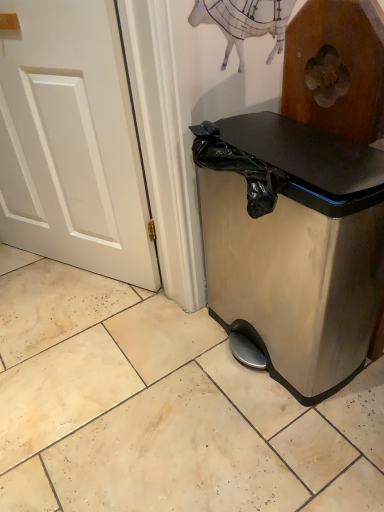
Question: Does satin silver trash can at lower right have a greater width compared to white painted wood door at left?

Choices:
 (A) yes
 (B) no

Answer: (A)

Question: Can you confirm if satin silver trash can at lower right is shorter than white painted wood door at left?

Choices:
 (A) yes
 (B) no

Answer: (A)

Question: From the image's perspective, does satin silver trash can at lower right appear higher than white painted wood door at left?

Choices:
 (A) yes
 (B) no

Answer: (B)

Question: Is white painted wood door at left completely or partially inside satin silver trash can at lower right?

Choices:
 (A) no
 (B) yes

Answer: (A)

Question: Considering the relative sizes of satin silver trash can at lower right and white painted wood door at left in the image provided, is satin silver trash can at lower right smaller than white painted wood door at left?

Choices:
 (A) yes
 (B) no

Answer: (B)

Question: Is satin silver trash can at lower right outside white painted wood door at left?

Choices:
 (A) no
 (B) yes

Answer: (B)

Question: Is satin silver trash can at lower right at the back of white painted wood door at left?

Choices:
 (A) no
 (B) yes

Answer: (A)

Question: Is white painted wood door at left wider than satin silver trash can at lower right?

Choices:
 (A) yes
 (B) no

Answer: (B)

Question: Is white painted wood door at left thinner than satin silver trash can at lower right?

Choices:
 (A) no
 (B) yes

Answer: (B)

Question: Does white painted wood door at left come behind satin silver trash can at lower right?

Choices:
 (A) yes
 (B) no

Answer: (A)

Question: Is satin silver trash can at lower right a part of white painted wood door at left?

Choices:
 (A) yes
 (B) no

Answer: (B)

Question: Does white painted wood door at left have a lesser height compared to satin silver trash can at lower right?

Choices:
 (A) no
 (B) yes

Answer: (A)

Question: From the image's perspective, relative to satin silver trash can at lower right, is white painted wood door at left above or below?

Choices:
 (A) below
 (B) above

Answer: (B)